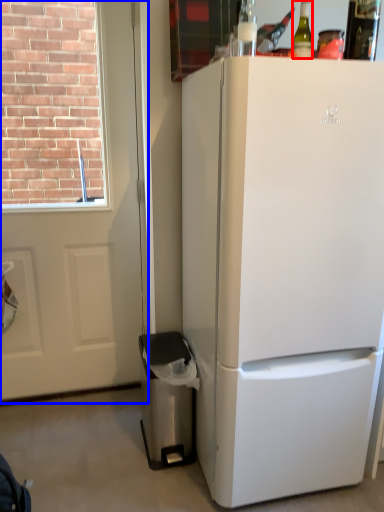
Question: Which object is further to the camera taking this photo, bottle (highlighted by a red box) or screen door (highlighted by a blue box)?

Choices:
 (A) bottle
 (B) screen door

Answer: (B)